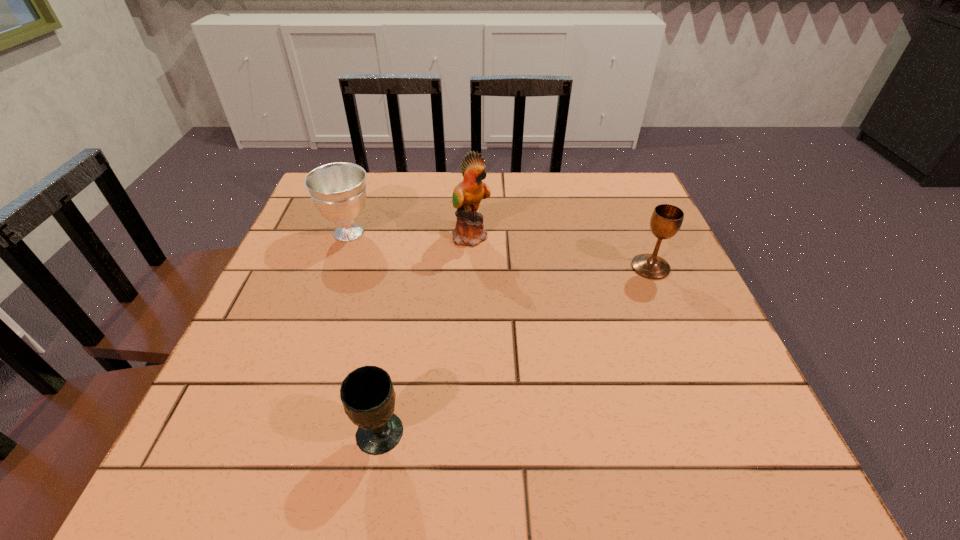
This screenshot has width=960, height=540. I want to click on vacant area that lies between the rightmost chalice and the second object from left to right, so click(515, 350).

Find the location of `free space between the nearest object and the second farthest chalice`. free space between the nearest object and the second farthest chalice is located at coordinates (515, 350).

This screenshot has height=540, width=960. In order to click on vacant area that lies between the second nearest chalice and the nearest object in this screenshot , I will do `click(515, 350)`.

Where is `the second closest object to the second nearest chalice`? the second closest object to the second nearest chalice is located at coordinates (367, 394).

Select which object is the third closest to the tallest object. Please provide its 2D coordinates. Your answer should be formatted as a tuple, i.e. [(x, y)], where the tuple contains the x and y coordinates of a point satisfying the conditions above.

[(367, 394)]

Point out which chalice is positioned as the second nearest to the second farthest chalice. Please provide its 2D coordinates. Your answer should be formatted as a tuple, i.e. [(x, y)], where the tuple contains the x and y coordinates of a point satisfying the conditions above.

[(338, 190)]

Select which chalice is the second closest to the second chalice from left to right. Please provide its 2D coordinates. Your answer should be formatted as a tuple, i.e. [(x, y)], where the tuple contains the x and y coordinates of a point satisfying the conditions above.

[(666, 220)]

This screenshot has height=540, width=960. Find the location of `vacant area in the image that satisfies the following two spatial constraints: 1. on the front side of the farthest chalice; 2. on the right side of the second chalice from left to right`. vacant area in the image that satisfies the following two spatial constraints: 1. on the front side of the farthest chalice; 2. on the right side of the second chalice from left to right is located at coordinates (277, 434).

Locate an element on the screen. The image size is (960, 540). vacant point that satisfies the following two spatial constraints: 1. on the front-facing side of the third object from left to right; 2. on the back side of the rightmost object is located at coordinates (470, 267).

Where is `free space that satisfies the following two spatial constraints: 1. on the front side of the rightmost chalice; 2. on the right side of the leftmost chalice`? The image size is (960, 540). free space that satisfies the following two spatial constraints: 1. on the front side of the rightmost chalice; 2. on the right side of the leftmost chalice is located at coordinates (337, 267).